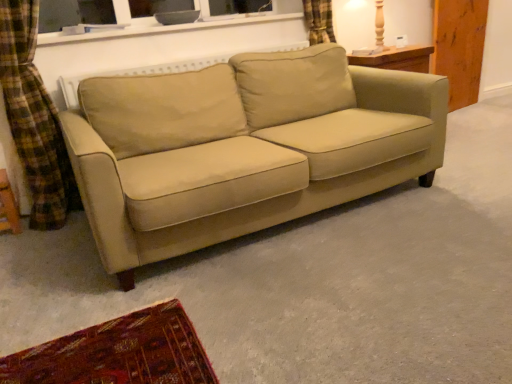
Describe the element at coordinates (361, 26) in the screenshot. I see `wooden table lamp at upper right` at that location.

Find the location of a particular element. wooden table lamp at upper right is located at coordinates (361, 26).

What is the approximate width of wooden table lamp at upper right?

It is 11.84 inches.

Image resolution: width=512 pixels, height=384 pixels. Identify the location of beige fabric couch at center. (241, 152).

Describe the element at coordinates (241, 152) in the screenshot. The height and width of the screenshot is (384, 512). I see `beige fabric couch at center` at that location.

Locate an element on the screen. Image resolution: width=512 pixels, height=384 pixels. wooden table lamp at upper right is located at coordinates (361, 26).

Can you confirm if wooden table lamp at upper right is positioned to the left of beige fabric couch at center?

In fact, wooden table lamp at upper right is to the right of beige fabric couch at center.

Considering the relative positions of wooden table lamp at upper right and beige fabric couch at center in the image provided, is wooden table lamp at upper right in front of beige fabric couch at center?

No, wooden table lamp at upper right is further to the viewer.

Which point is more distant from viewer, (x=358, y=16) or (x=220, y=156)?

Point (x=358, y=16)

From the image's perspective, does wooden table lamp at upper right appear lower than beige fabric couch at center?

Actually, wooden table lamp at upper right appears above beige fabric couch at center in the image.

From a real-world perspective, is wooden table lamp at upper right located beneath beige fabric couch at center?

No.

Is wooden table lamp at upper right thinner than beige fabric couch at center?

Yes, wooden table lamp at upper right is thinner than beige fabric couch at center.

Which of these two, wooden table lamp at upper right or beige fabric couch at center, stands shorter?

wooden table lamp at upper right.

Between wooden table lamp at upper right and beige fabric couch at center, which one has smaller size?

Smaller between the two is wooden table lamp at upper right.

Is beige fabric couch at center inside wooden table lamp at upper right?

No.

Are wooden table lamp at upper right and beige fabric couch at center making contact?

No, wooden table lamp at upper right is not making contact with beige fabric couch at center.

Based on the photo, is wooden table lamp at upper right oriented towards beige fabric couch at center?

No.

This screenshot has height=384, width=512. I want to click on table lamp located above the beige fabric couch at center (from a real-world perspective), so click(x=361, y=26).

In the scene shown: Is beige fabric couch at center to the left or to the right of wooden table lamp at upper right in the image?

In the image, beige fabric couch at center appears on the left side of wooden table lamp at upper right.

Is beige fabric couch at center closer to camera compared to wooden table lamp at upper right?

Yes.

Does point (146, 236) come behind point (376, 48)?

That is False.

From the image's perspective, which is below, beige fabric couch at center or wooden table lamp at upper right?

beige fabric couch at center, from the image's perspective.

From a real-world perspective, between beige fabric couch at center and wooden table lamp at upper right, who is vertically higher?

From a 3D spatial view, wooden table lamp at upper right is above.

Looking at this image, is beige fabric couch at center thinner than wooden table lamp at upper right?

In fact, beige fabric couch at center might be wider than wooden table lamp at upper right.

Is beige fabric couch at center taller than wooden table lamp at upper right?

Yes, beige fabric couch at center is taller than wooden table lamp at upper right.

Who is smaller, beige fabric couch at center or wooden table lamp at upper right?

With smaller size is wooden table lamp at upper right.

Do you think beige fabric couch at center is within wooden table lamp at upper right, or outside of it?

beige fabric couch at center is spatially situated outside wooden table lamp at upper right.

Is beige fabric couch at center touching wooden table lamp at upper right?

No, beige fabric couch at center is not touching wooden table lamp at upper right.

From the picture: Is beige fabric couch at center facing towards wooden table lamp at upper right?

No, beige fabric couch at center is not facing towards wooden table lamp at upper right.

How different are the orientations of beige fabric couch at center and wooden table lamp at upper right in degrees?

beige fabric couch at center and wooden table lamp at upper right are facing 1.17 degrees away from each other.

This screenshot has height=384, width=512. What are the coordinates of `studio couch below the wooden table lamp at upper right (from a real-world perspective)` in the screenshot? It's located at (241, 152).

You are a GUI agent. You are given a task and a screenshot of the screen. Output one action in this format:
    pyautogui.click(x=<x>, y=<y>)
    Task: Click on the studio couch in front of the wooden table lamp at upper right
    
    Given the screenshot: What is the action you would take?
    pyautogui.click(x=241, y=152)

You are a GUI agent. You are given a task and a screenshot of the screen. Output one action in this format:
    pyautogui.click(x=<x>, y=<y>)
    Task: Click on the table lamp on the right side of beige fabric couch at center
    Image resolution: width=512 pixels, height=384 pixels.
    Given the screenshot: What is the action you would take?
    pyautogui.click(x=361, y=26)